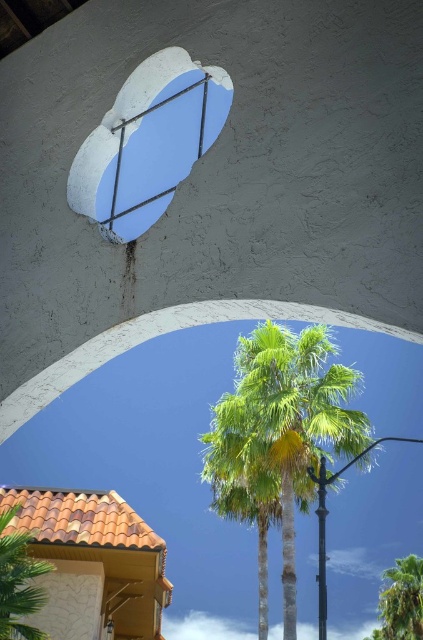
Does white concrete archway at center have a larger size compared to green leafy palm at lower left?

Yes.

Does white concrete archway at center have a lesser width compared to green leafy palm at lower left?

No.

The height and width of the screenshot is (640, 423). I want to click on white concrete archway at center, so click(161, 467).

Can you confirm if white concrete archway at center is smaller than white concrete window at upper center?

Incorrect, white concrete archway at center is not smaller in size than white concrete window at upper center.

Measure the distance from white concrete archway at center to white concrete window at upper center.

A distance of 16.16 meters exists between white concrete archway at center and white concrete window at upper center.

This screenshot has width=423, height=640. Describe the element at coordinates (161, 467) in the screenshot. I see `white concrete archway at center` at that location.

The image size is (423, 640). Find the location of `white concrete archway at center`. white concrete archway at center is located at coordinates (161, 467).

Between green leafy palm tree at center and white concrete window at upper center, which one is positioned lower?

green leafy palm tree at center is lower down.

Based on the photo, between green leafy palm tree at center and white concrete window at upper center, which one has less height?

With less height is white concrete window at upper center.

Between point (238, 358) and point (106, 195), which one is positioned in front?

Point (106, 195) is more forward.

Find the location of a particular element. green leafy palm tree at center is located at coordinates (285, 422).